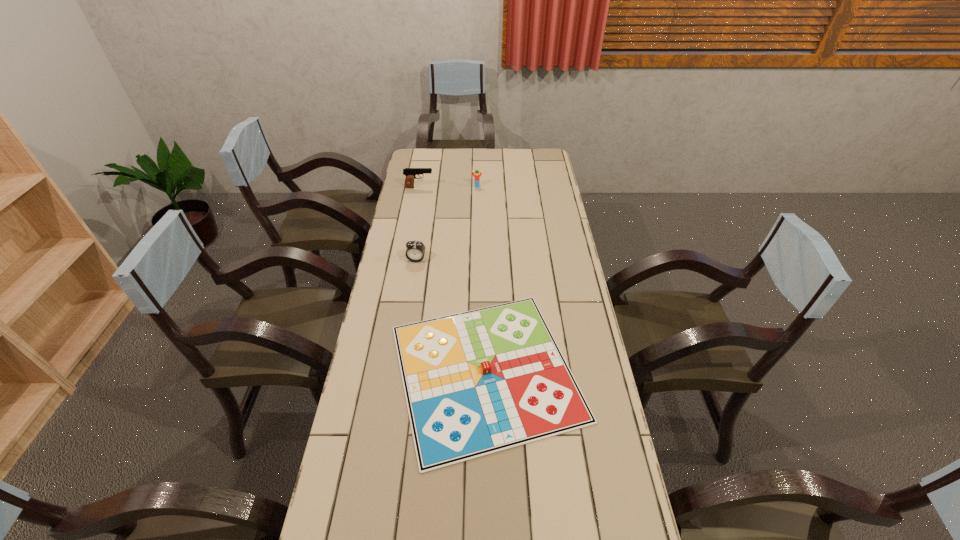
This screenshot has width=960, height=540. Find the location of `the tallest object`. the tallest object is located at coordinates (410, 173).

Locate an element on the screen. Lego is located at coordinates tap(476, 177).

I want to click on alarm clock, so click(x=415, y=251).

The width and height of the screenshot is (960, 540). I want to click on gameboard, so click(478, 382).

This screenshot has width=960, height=540. I want to click on the nearest object, so click(478, 382).

Find the location of `blank space located 0.100m at the barrel of the pistol`. blank space located 0.100m at the barrel of the pistol is located at coordinates (454, 187).

At what (x,y) coordinates should I click in order to perform the action: click on free space located on the face of the Lego. Please return your answer as a coordinate pair (x, y). Image resolution: width=960 pixels, height=540 pixels. Looking at the image, I should click on (477, 214).

At what (x,y) coordinates should I click in order to perform the action: click on blank space located 0.240m on the front side of the second nearest object. Please return your answer as a coordinate pair (x, y). The height and width of the screenshot is (540, 960). Looking at the image, I should click on (408, 309).

Where is `vacant region located on the back of the shortest object`? Image resolution: width=960 pixels, height=540 pixels. vacant region located on the back of the shortest object is located at coordinates (484, 241).

Identify the location of pistol at the left edge. (410, 173).